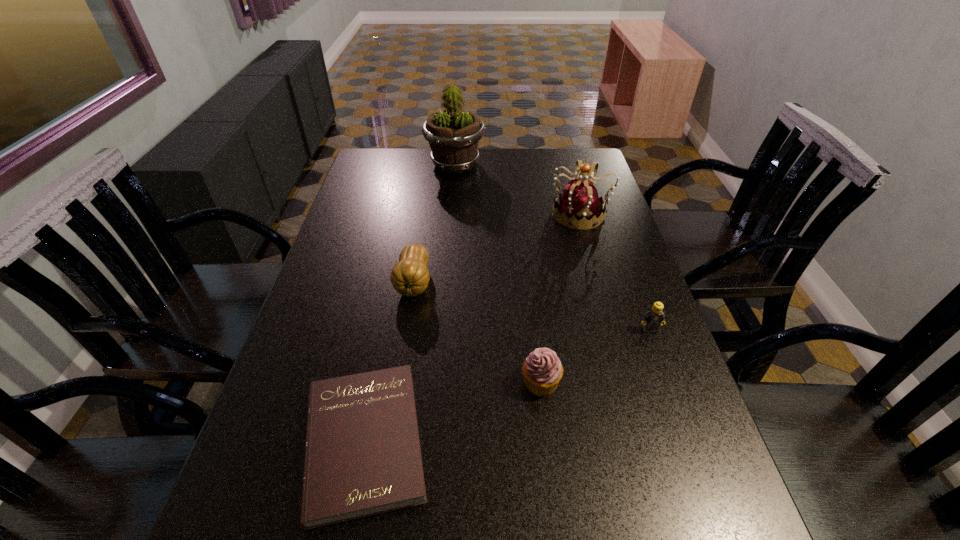
The height and width of the screenshot is (540, 960). Find the location of `vacant area at the left edge of the desktop`. vacant area at the left edge of the desktop is located at coordinates (291, 535).

The image size is (960, 540). Find the location of `vacant space at the right edge of the desktop`. vacant space at the right edge of the desktop is located at coordinates (596, 294).

This screenshot has height=540, width=960. Find the location of `vacant space at the far left corner of the desktop`. vacant space at the far left corner of the desktop is located at coordinates [372, 171].

Where is `empty space between the shortest object and the fourth nearest object`? empty space between the shortest object and the fourth nearest object is located at coordinates pyautogui.click(x=389, y=362).

Find the location of a particular element. free area in between the Lego and the third object from right to left is located at coordinates (595, 356).

Locate an element on the screen. This screenshot has width=960, height=540. empty space between the fourth nearest object and the Lego is located at coordinates (532, 306).

Where is `free space between the fourth farthest object and the gourd`? The image size is (960, 540). free space between the fourth farthest object and the gourd is located at coordinates (532, 306).

The image size is (960, 540). Identify the location of vacant space in between the third object from right to left and the farthest object. (498, 273).

You are a GUI agent. You are given a task and a screenshot of the screen. Output one action in this format:
    pyautogui.click(x=<x>, y=<y>)
    Task: Click on the vacant region between the second tallest object and the tallest object
    The image size is (960, 540).
    Given the screenshot: What is the action you would take?
    pyautogui.click(x=517, y=189)

At what (x,y) coordinates should I click in order to perform the action: click on empty location between the fourth farthest object and the hardback book. Please return your answer as a coordinate pair (x, y). Looking at the image, I should click on (507, 386).